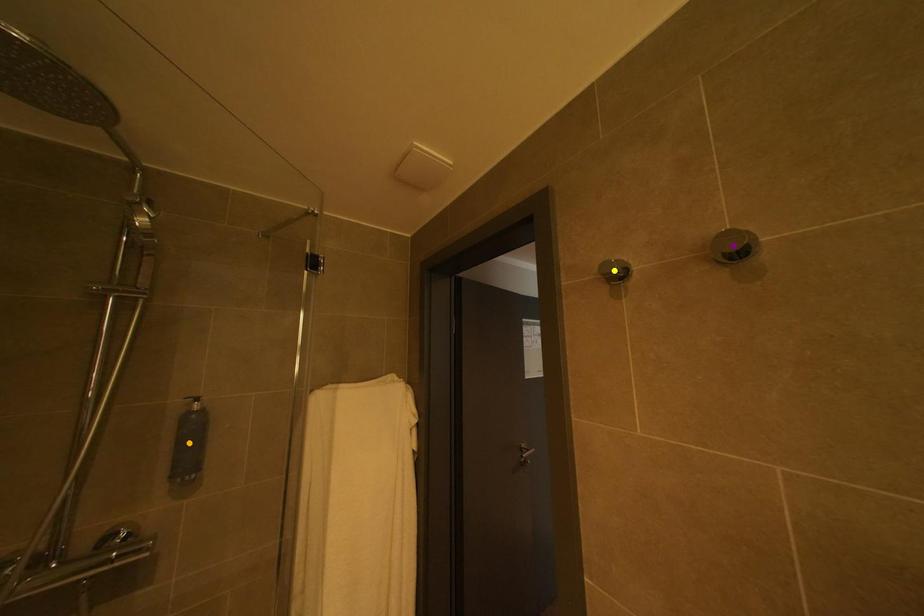
Order these from nearest to farthest:
1. purple point
2. orange point
3. yellow point

purple point
yellow point
orange point